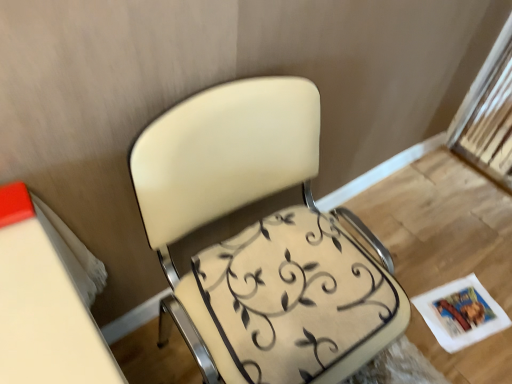
Question: Is white paper magazine at lower right positioned far away from matte cream chair at center?

Choices:
 (A) yes
 (B) no

Answer: (B)

Question: Does white paper magazine at lower right lie in front of matte cream chair at center?

Choices:
 (A) yes
 (B) no

Answer: (B)

Question: Is white paper magazine at lower right oriented away from matte cream chair at center?

Choices:
 (A) yes
 (B) no

Answer: (B)

Question: Can you confirm if white paper magazine at lower right is taller than matte cream chair at center?

Choices:
 (A) no
 (B) yes

Answer: (A)

Question: From a real-world perspective, is white paper magazine at lower right over matte cream chair at center?

Choices:
 (A) yes
 (B) no

Answer: (B)

Question: Looking at their shapes, would you say beige fabric swivel chair at center is wider or thinner than matte cream chair at center?

Choices:
 (A) wide
 (B) thin

Answer: (B)

Question: From a real-world perspective, is beige fabric swivel chair at center physically located above or below matte cream chair at center?

Choices:
 (A) below
 (B) above

Answer: (B)

Question: Is beige fabric swivel chair at center spatially inside matte cream chair at center, or outside of it?

Choices:
 (A) inside
 (B) outside

Answer: (A)

Question: From the image's perspective, is beige fabric swivel chair at center located above or below matte cream chair at center?

Choices:
 (A) above
 (B) below

Answer: (B)

Question: Considering the positions of matte cream chair at center and beige fabric swivel chair at center in the image, is matte cream chair at center bigger or smaller than beige fabric swivel chair at center?

Choices:
 (A) small
 (B) big

Answer: (B)

Question: Choose the correct answer: Is matte cream chair at center inside beige fabric swivel chair at center or outside it?

Choices:
 (A) outside
 (B) inside

Answer: (A)

Question: From a real-world perspective, is matte cream chair at center above or below beige fabric swivel chair at center?

Choices:
 (A) above
 (B) below

Answer: (B)

Question: In terms of height, does matte cream chair at center look taller or shorter compared to beige fabric swivel chair at center?

Choices:
 (A) tall
 (B) short

Answer: (A)

Question: From the image's perspective, is white paper magazine at lower right located above or below matte cream chair at center?

Choices:
 (A) below
 (B) above

Answer: (A)

Question: In terms of width, does white paper magazine at lower right look wider or thinner when compared to matte cream chair at center?

Choices:
 (A) wide
 (B) thin

Answer: (B)